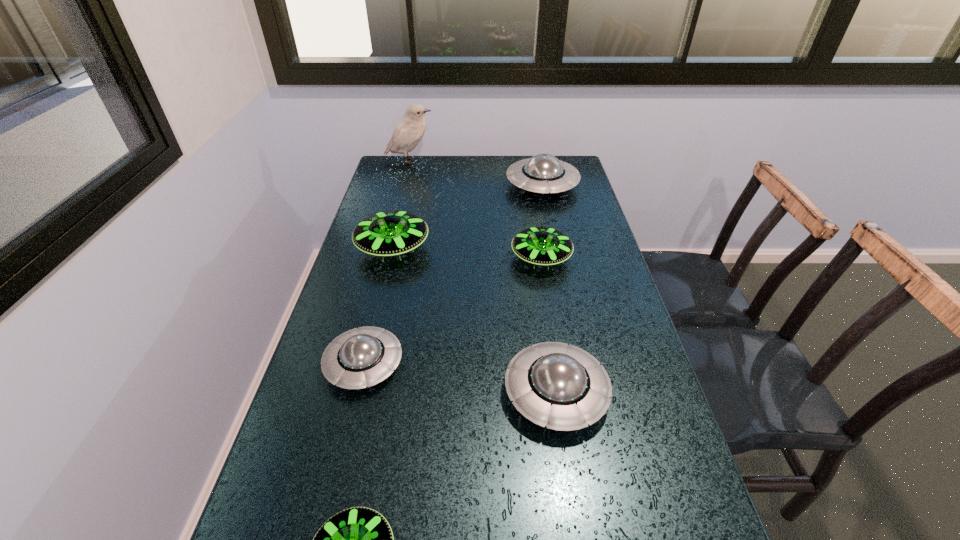
Identify which object is the second nearest to the white bird. Please provide its 2D coordinates. Your answer should be formatted as a tuple, i.e. [(x, y)], where the tuple contains the x and y coordinates of a point satisfying the conditions above.

[(390, 233)]

This screenshot has height=540, width=960. Identify the location of object that can be found as the fourth closest to the biggest green saucer. (553, 384).

Find the location of `the closest saucer relative to the second biggest gray saucer`. the closest saucer relative to the second biggest gray saucer is located at coordinates pos(366,356).

Identify which saucer is the third nearest to the rightmost green saucer. Please provide its 2D coordinates. Your answer should be formatted as a tuple, i.e. [(x, y)], where the tuple contains the x and y coordinates of a point satisfying the conditions above.

[(553, 384)]

The width and height of the screenshot is (960, 540). I want to click on the second closest gray saucer relative to the second smallest green saucer, so click(x=553, y=384).

Choose which gray saucer is the second nearest neighbor to the tallest object. Please provide its 2D coordinates. Your answer should be formatted as a tuple, i.e. [(x, y)], where the tuple contains the x and y coordinates of a point satisfying the conditions above.

[(366, 356)]

What are the coordinates of `green saucer object that ranks as the closest to the second smallest gray saucer` in the screenshot? It's located at (359, 539).

This screenshot has width=960, height=540. I want to click on green saucer that can be found as the second closest to the shortest object, so click(543, 246).

You are a GUI agent. You are given a task and a screenshot of the screen. Output one action in this format:
    pyautogui.click(x=<x>, y=<y>)
    Task: Click on the vacant space that satisfies the following two spatial constraints: 1. on the back side of the leftmost gray saucer; 2. on the right side of the biggest green saucer
    
    Given the screenshot: What is the action you would take?
    pyautogui.click(x=393, y=248)